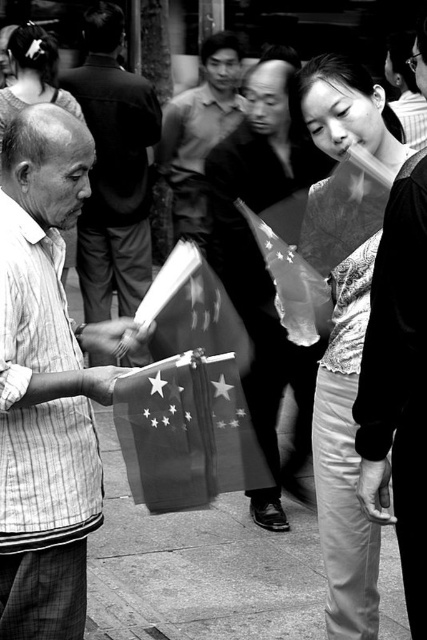
Who is shorter, striped fabric shirt at left or smooth paper bag at center?

Standing shorter between the two is striped fabric shirt at left.

Is point (82, 525) positioned after point (96, 148)?

No, it is not.

Locate an element on the screen. striped fabric shirt at left is located at coordinates pyautogui.click(x=46, y=384).

Does smooth fabric shirt at center have a greater width compared to shiny metallic flag at center?

Yes, smooth fabric shirt at center is wider than shiny metallic flag at center.

In the scene shown: Does smooth fabric shirt at center appear on the right side of shiny metallic flag at center?

No, smooth fabric shirt at center is not to the right of shiny metallic flag at center.

Where is `smooth fabric shirt at center`? The width and height of the screenshot is (427, 640). smooth fabric shirt at center is located at coordinates (198, 134).

Is smooth paper bag at center bigger than shiny metallic flag at center?

Indeed, smooth paper bag at center has a larger size compared to shiny metallic flag at center.

Does smooth paper bag at center appear under shiny metallic flag at center?

Result: No.

Is point (110, 284) less distant than point (280, 282)?

No, (110, 284) is behind (280, 282).

The height and width of the screenshot is (640, 427). Find the location of `smooth paper bag at center`. smooth paper bag at center is located at coordinates (114, 170).